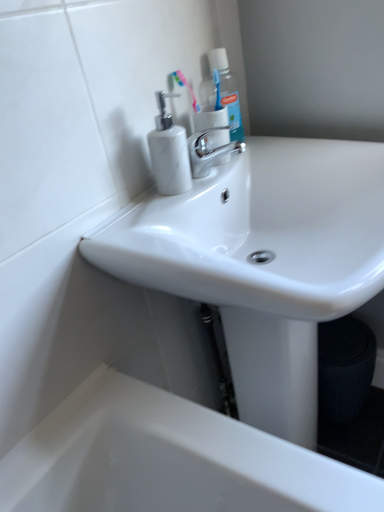
Question: Is white marble soap dispenser at upper left oriented towards pink plastic toothbrush at upper center?

Choices:
 (A) yes
 (B) no

Answer: (B)

Question: Does white marble soap dispenser at upper left touch pink plastic toothbrush at upper center?

Choices:
 (A) no
 (B) yes

Answer: (A)

Question: From the image's perspective, is white marble soap dispenser at upper left above pink plastic toothbrush at upper center?

Choices:
 (A) no
 (B) yes

Answer: (A)

Question: Could pink plastic toothbrush at upper center be considered to be inside white marble soap dispenser at upper left?

Choices:
 (A) yes
 (B) no

Answer: (B)

Question: Is white marble soap dispenser at upper left far from pink plastic toothbrush at upper center?

Choices:
 (A) yes
 (B) no

Answer: (B)

Question: Considering the relative sizes of white marble soap dispenser at upper left and pink plastic toothbrush at upper center in the image provided, is white marble soap dispenser at upper left thinner than pink plastic toothbrush at upper center?

Choices:
 (A) yes
 (B) no

Answer: (B)

Question: Does white marble soap dispenser at upper left turn towards polished chrome faucet at center?

Choices:
 (A) yes
 (B) no

Answer: (B)

Question: Are white marble soap dispenser at upper left and polished chrome faucet at center making contact?

Choices:
 (A) no
 (B) yes

Answer: (B)

Question: Considering the relative sizes of white marble soap dispenser at upper left and polished chrome faucet at center in the image provided, is white marble soap dispenser at upper left bigger than polished chrome faucet at center?

Choices:
 (A) no
 (B) yes

Answer: (B)

Question: Is white marble soap dispenser at upper left positioned before polished chrome faucet at center?

Choices:
 (A) yes
 (B) no

Answer: (A)

Question: Considering the relative sizes of white marble soap dispenser at upper left and polished chrome faucet at center in the image provided, is white marble soap dispenser at upper left thinner than polished chrome faucet at center?

Choices:
 (A) yes
 (B) no

Answer: (A)

Question: Is white marble soap dispenser at upper left far away from polished chrome faucet at center?

Choices:
 (A) yes
 (B) no

Answer: (B)

Question: Does translucent plastic mouthwash at upper center have a smaller size compared to pink plastic toothbrush at upper center?

Choices:
 (A) no
 (B) yes

Answer: (A)